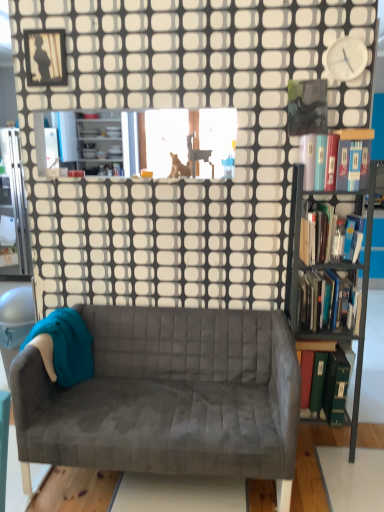
Question: Can you confirm if velvet gray couch at center is thinner than hardcover book at right, arranged as the third book when ordered from the bottom?

Choices:
 (A) yes
 (B) no

Answer: (B)

Question: Is hardcover book at right, arranged as the 2th book when viewed from the top, a part of velvet gray couch at center?

Choices:
 (A) yes
 (B) no

Answer: (B)

Question: Can you confirm if velvet gray couch at center is bigger than hardcover book at right, arranged as the third book when ordered from the bottom?

Choices:
 (A) no
 (B) yes

Answer: (B)

Question: Does velvet gray couch at center come in front of hardcover book at right, arranged as the 2th book when viewed from the top?

Choices:
 (A) no
 (B) yes

Answer: (B)

Question: Is velvet gray couch at center turned away from hardcover book at right, arranged as the 2th book when viewed from the top?

Choices:
 (A) no
 (B) yes

Answer: (A)

Question: Can you confirm if velvet gray couch at center is shorter than hardcover book at right, arranged as the 2th book when viewed from the top?

Choices:
 (A) no
 (B) yes

Answer: (A)

Question: From the image's perspective, is velvet gray couch at center beneath brown furry dog at upper center?

Choices:
 (A) no
 (B) yes

Answer: (B)

Question: Is velvet gray couch at center looking in the opposite direction of brown furry dog at upper center?

Choices:
 (A) no
 (B) yes

Answer: (A)

Question: Can you confirm if velvet gray couch at center is thinner than brown furry dog at upper center?

Choices:
 (A) no
 (B) yes

Answer: (A)

Question: Can you confirm if velvet gray couch at center is positioned to the right of brown furry dog at upper center?

Choices:
 (A) yes
 (B) no

Answer: (B)

Question: Does velvet gray couch at center lie in front of brown furry dog at upper center?

Choices:
 (A) no
 (B) yes

Answer: (B)

Question: Can you confirm if velvet gray couch at center is positioned to the left of brown furry dog at upper center?

Choices:
 (A) yes
 (B) no

Answer: (A)

Question: Does white plastic clock at upper right turn towards metallic black bookcase at right?

Choices:
 (A) no
 (B) yes

Answer: (A)